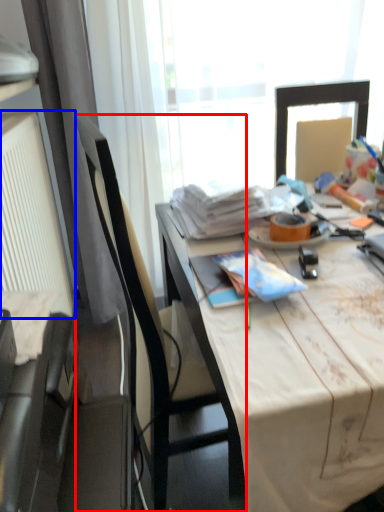
Question: Which of the following is the farthest to the observer, chair (highlighted by a red box) or radiator (highlighted by a blue box)?

Choices:
 (A) chair
 (B) radiator

Answer: (B)